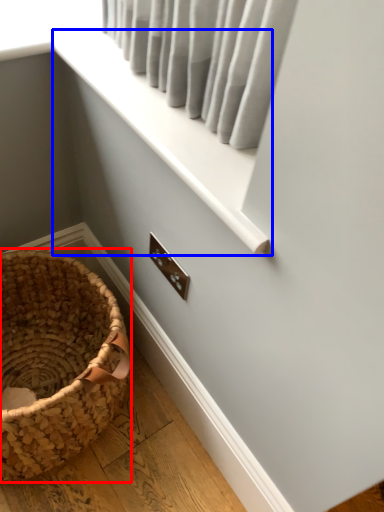
Question: Which point is closer to the camera, picnic basket (highlighted by a red box) or window frame (highlighted by a blue box)?

Choices:
 (A) picnic basket
 (B) window frame

Answer: (B)